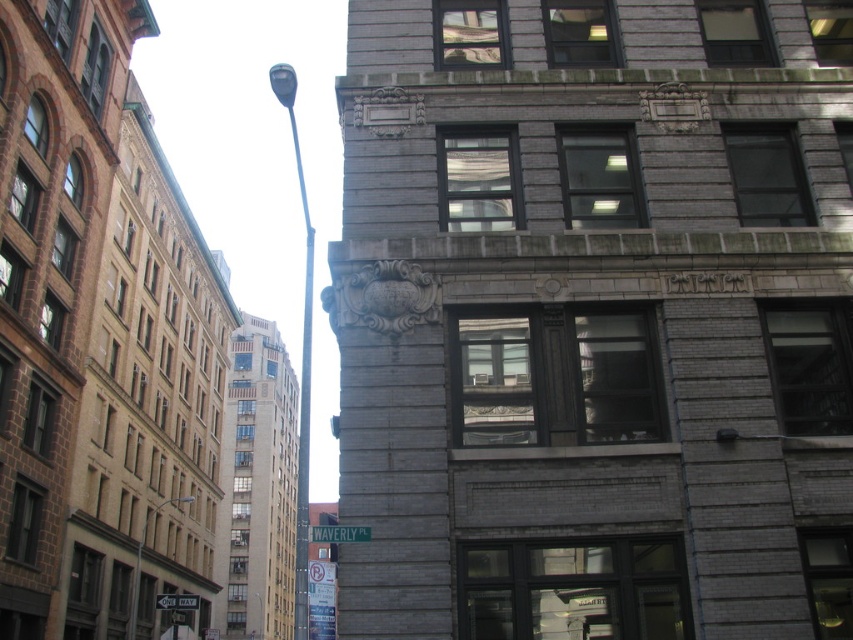
You are a delivery driver who needs to read both the green metallic street sign at upper center and the green plastic street sign at lower center while driving. Which sign will be harder to see from a distance?

The green metallic street sign at upper center is thinner than the green plastic street sign at lower center, so it will be harder to see from a distance.

You are a pedestrian standing on the sidewalk and see the metallic pole at center and the green metallic street sign at upper center. Which object is closer to your left side?

The metallic pole at center is positioned on the left side of green metallic street sign at upper center, so it is closer to your left side.

You are a pedestrian standing on the sidewalk and see the metallic pole at center and the green metallic street sign at upper center. Which object is closer to you?

The metallic pole at center is closer to you because it is positioned under the green metallic street sign at upper center, meaning it is located below and nearer in the visual field.